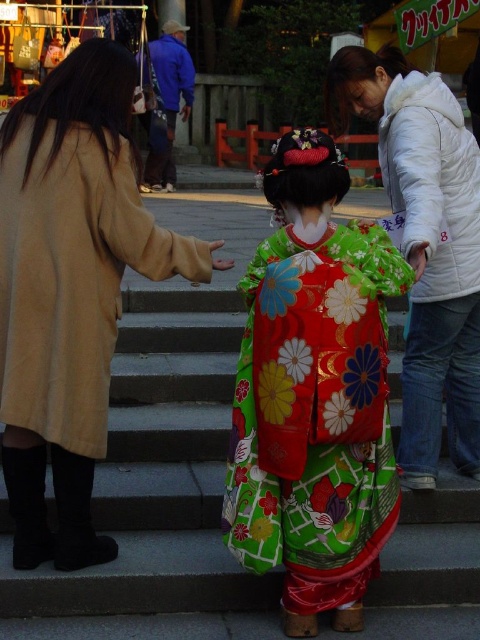
You are standing at the center of the image. Which object is located at the coordinates point (70, 289)?

The beige wool coat at left is located at point (70, 289).

You are a photographer standing 10 feet away from the floral silk kimono at center. Can you take a clear photo of it without moving closer?

The floral silk kimono at center and camera are 9.95 feet apart, so yes, you can take a clear photo of it without moving closer since the distance is just under 10 feet.

You are a photographer trying to capture the scene. You notice the beige wool coat at left and the matte brown hand at center. Which object is positioned to the left of the other?

A: The beige wool coat at left is to the left of the matte brown hand at center.